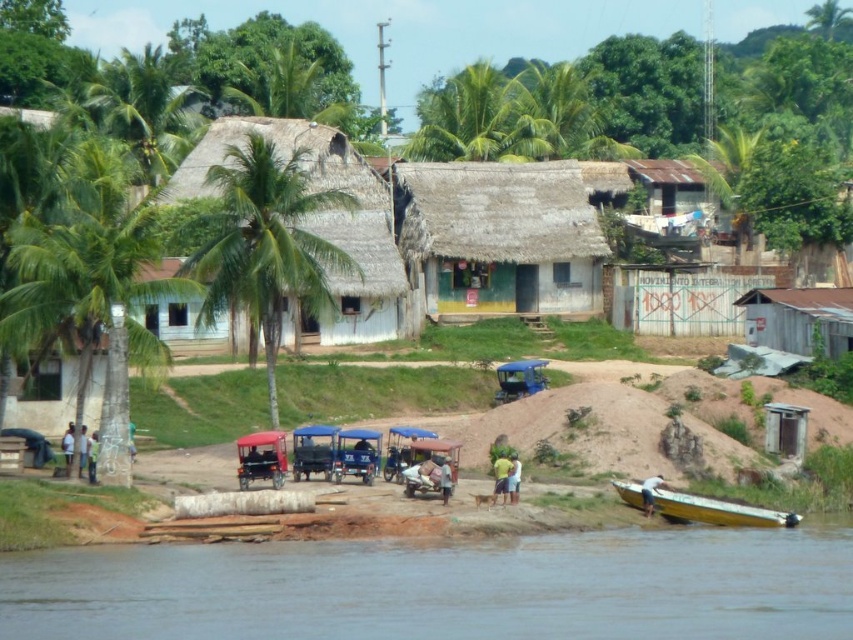
Question: Which object is closer to the camera taking this photo?

Choices:
 (A) yellow fabric shirt at center
 (B) yellow matte boat at lower right
 (C) brown thatched hut at upper center
 (D) brown fabric shirt at center

Answer: (D)

Question: Does brown fabric shirt at center have a larger size compared to light blue shirt at center?

Choices:
 (A) no
 (B) yes

Answer: (B)

Question: Which point is closer to the camera taking this photo?

Choices:
 (A) (515, 481)
 (B) (444, 474)

Answer: (B)

Question: Which object appears farthest from the camera in this image?

Choices:
 (A) brown sedimentary river at lower center
 (B) green leafy palm tree at left

Answer: (B)

Question: Does green leafy palm tree at left have a smaller size compared to brown corrugated metal hut at lower right?

Choices:
 (A) yes
 (B) no

Answer: (A)

Question: Observing the image, what is the correct spatial positioning of brown sedimentary river at lower center in reference to yellow matte boat at lower right?

Choices:
 (A) left
 (B) right

Answer: (A)